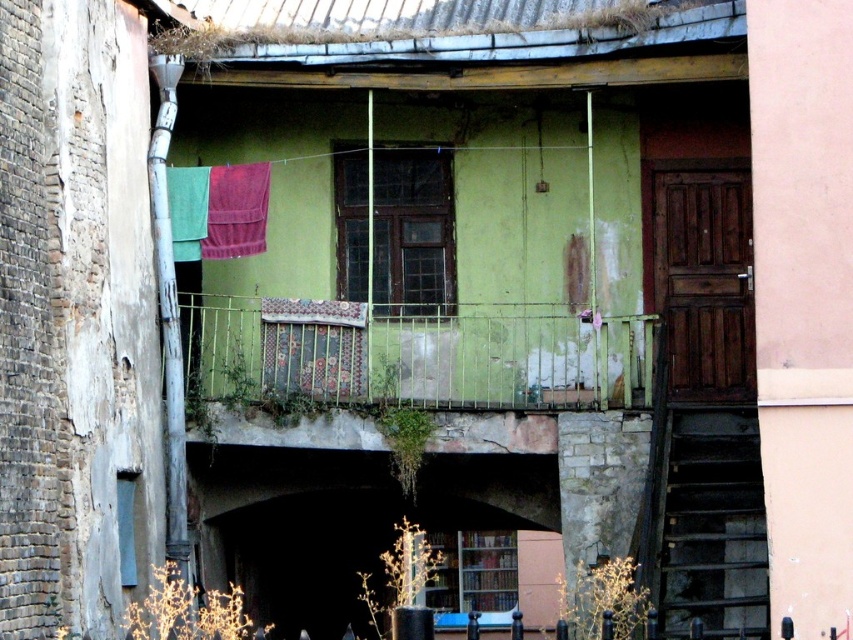
Is point (292, 380) positioned behind point (264, 221)?

No.

Measure the distance between point (357, 396) and camera.

Point (357, 396) and camera are 42.65 meters apart.

The image size is (853, 640). Describe the element at coordinates (314, 346) in the screenshot. I see `floral fabric curtain at center` at that location.

Where is `floral fabric curtain at center`? The width and height of the screenshot is (853, 640). floral fabric curtain at center is located at coordinates (314, 346).

Does green metal railing at center have a greater height compared to floral fabric curtain at center?

Correct, green metal railing at center is much taller as floral fabric curtain at center.

Who is taller, green metal railing at center or floral fabric curtain at center?

green metal railing at center

The image size is (853, 640). What do you see at coordinates (419, 356) in the screenshot?
I see `green metal railing at center` at bounding box center [419, 356].

The image size is (853, 640). In order to click on green metal railing at center in this screenshot , I will do `click(419, 356)`.

Does point (637, 378) come closer to viewer compared to point (218, 232)?

No, (637, 378) is behind (218, 232).

Is point (479, 388) more distant than point (247, 224)?

Yes, point (479, 388) is farther from viewer.

At what (x,y) coordinates should I click in order to perform the action: click on green metal railing at center. Please return your answer as a coordinate pair (x, y). Looking at the image, I should click on (419, 356).